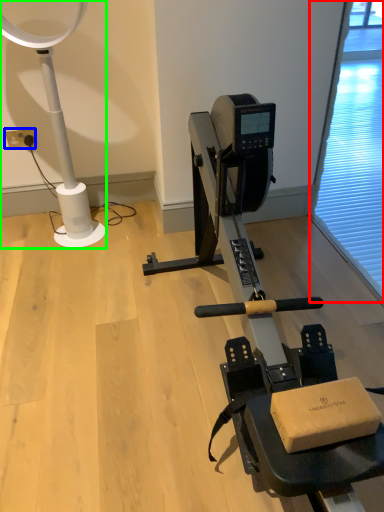
Question: Considering the real-world distances, which object is closest to screen door (highlighted by a red box)? electric outlet (highlighted by a blue box) or lamp (highlighted by a green box).

Choices:
 (A) electric outlet
 (B) lamp

Answer: (B)